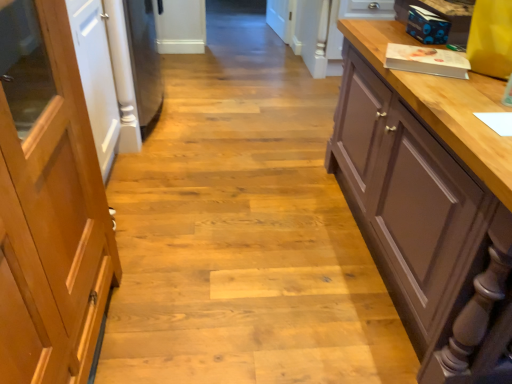
Question: Could you tell me if brown matte cupboard at right is turned towards light brown wood door at left?

Choices:
 (A) no
 (B) yes

Answer: (A)

Question: From a real-world perspective, is brown matte cupboard at right below light brown wood door at left?

Choices:
 (A) no
 (B) yes

Answer: (B)

Question: Can you confirm if brown matte cupboard at right is positioned to the right of light brown wood door at left?

Choices:
 (A) yes
 (B) no

Answer: (A)

Question: Considering the relative sizes of brown matte cupboard at right and light brown wood door at left in the image provided, is brown matte cupboard at right bigger than light brown wood door at left?

Choices:
 (A) yes
 (B) no

Answer: (A)

Question: From the image's perspective, is brown matte cupboard at right on light brown wood door at left?

Choices:
 (A) yes
 (B) no

Answer: (A)

Question: Is brown matte cupboard at right far from light brown wood door at left?

Choices:
 (A) yes
 (B) no

Answer: (A)

Question: Can brown matte cupboard at right be found inside light brown wood door at left?

Choices:
 (A) no
 (B) yes

Answer: (A)

Question: Is light brown wood door at left further to camera compared to brown matte cupboard at right?

Choices:
 (A) no
 (B) yes

Answer: (A)

Question: From the image's perspective, is light brown wood door at left located above brown matte cupboard at right?

Choices:
 (A) yes
 (B) no

Answer: (B)

Question: Is light brown wood door at left facing towards brown matte cupboard at right?

Choices:
 (A) yes
 (B) no

Answer: (A)

Question: Is the surface of light brown wood door at left in direct contact with brown matte cupboard at right?

Choices:
 (A) no
 (B) yes

Answer: (A)

Question: Considering the relative sizes of light brown wood door at left and brown matte cupboard at right in the image provided, is light brown wood door at left wider than brown matte cupboard at right?

Choices:
 (A) no
 (B) yes

Answer: (A)

Question: Is light brown wood door at left wider or thinner than brown matte cupboard at right?

Choices:
 (A) thin
 (B) wide

Answer: (A)